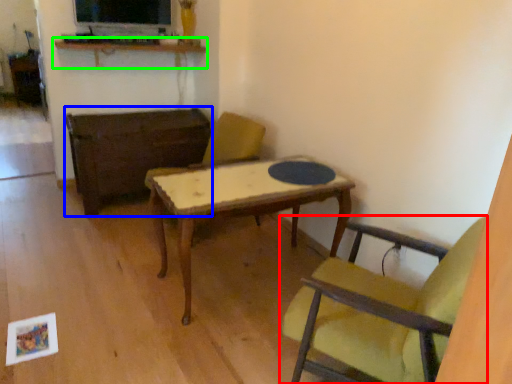
Question: Which object is positioned closest to chair (highlighted by a red box)? Select from table (highlighted by a blue box) and shelf (highlighted by a green box).

Choices:
 (A) table
 (B) shelf

Answer: (A)